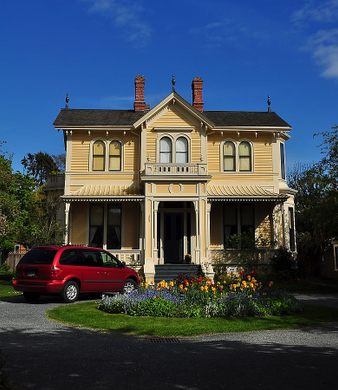
Identify the location of stairs. This screenshot has width=338, height=390. (168, 275).